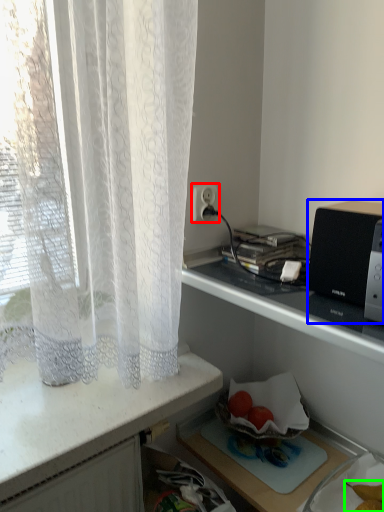
Question: Based on their relative distances, which object is nearer to electric outlet (highlighted by a red box)? Choose from appliance (highlighted by a blue box) and food (highlighted by a green box).

Choices:
 (A) appliance
 (B) food

Answer: (A)